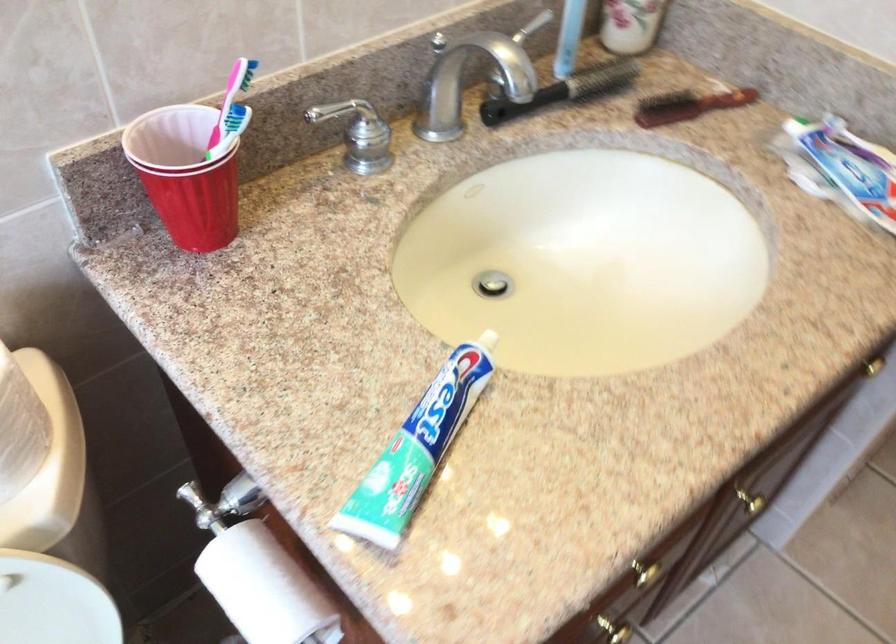
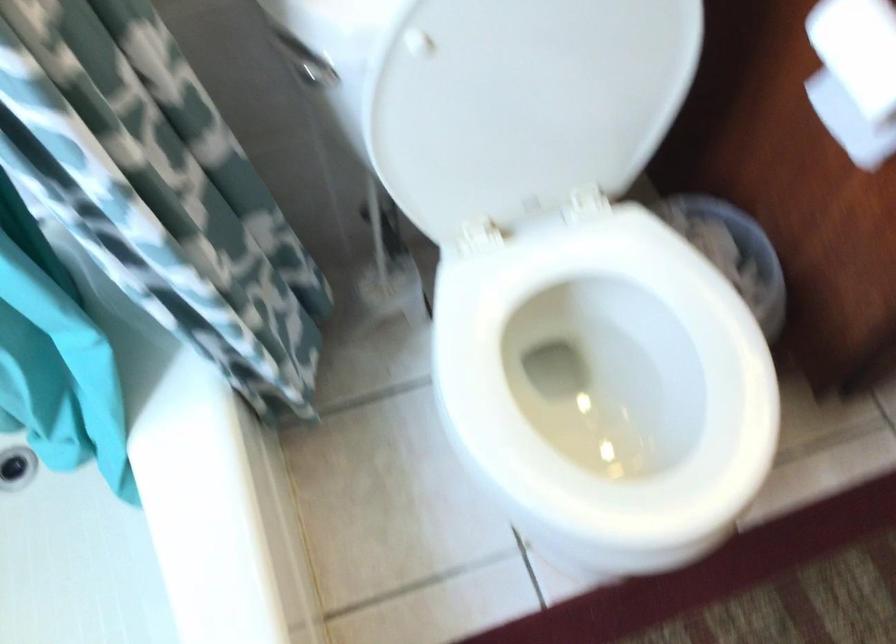
Question: How did the camera likely rotate?

Choices:
 (A) Left
 (B) Right
 (C) Up
 (D) Down

Answer: (D)